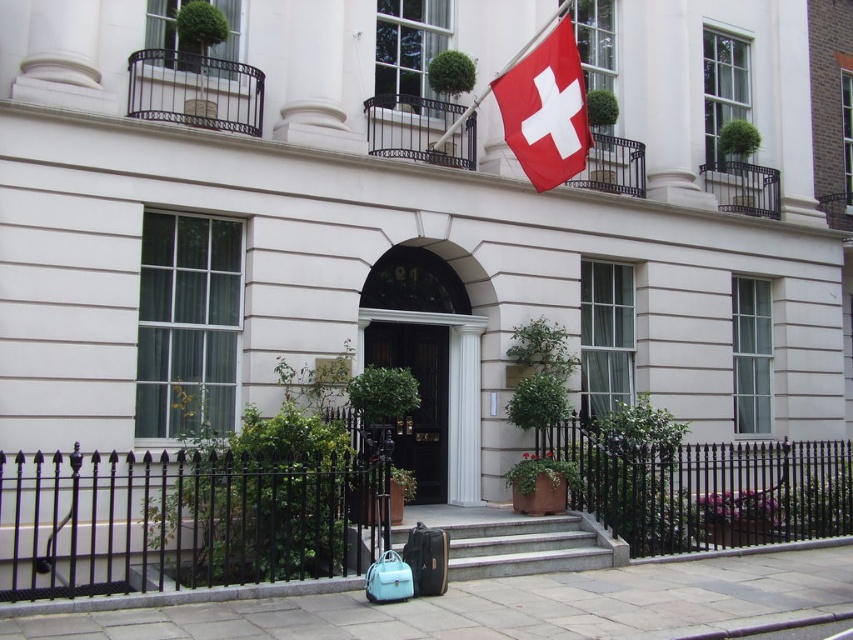
You are standing at the base of the smooth concrete stairs at center and looking up towards the red fabric flag at upper right. Which object is closer to you?

The red fabric flag at upper right is closer to you because it is positioned further to the viewer than the smooth concrete stairs at center.

You are a visitor approaching the entrance of the building. You see the red fabric flag at upper right and the smooth concrete stairs at center. Which object is located above the other?

The red fabric flag at upper right is positioned over the smooth concrete stairs at center, meaning it is above the stairs.